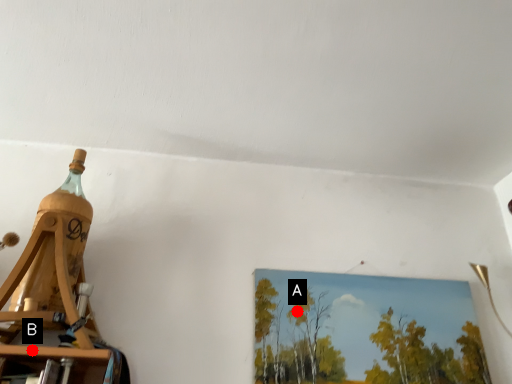
Question: Two points are circled on the image, labeled by A and B beside each circle. Among these points, which one is nearest to the camera?

Choices:
 (A) A is closer
 (B) B is closer

Answer: (B)